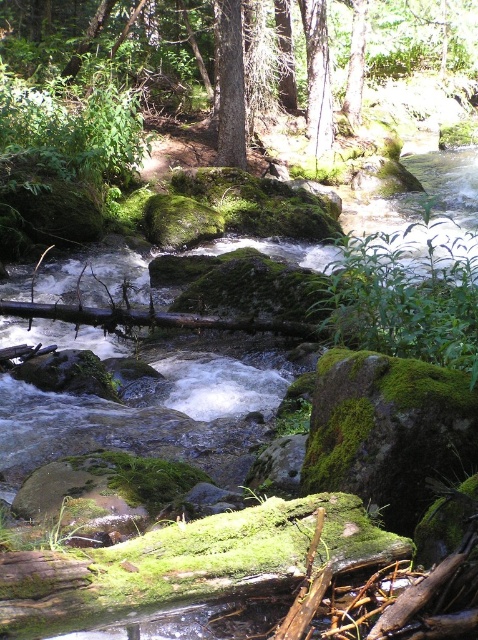
Question: Among these points, which one is nearest to the camera?

Choices:
 (A) (246, 152)
 (B) (358, 93)

Answer: (A)

Question: Can you confirm if green mossy rock at center is positioned to the left of green matte tree at center?

Choices:
 (A) no
 (B) yes

Answer: (A)

Question: Which point is farther from the camera taking this photo?

Choices:
 (A) (436, 51)
 (B) (237, 140)

Answer: (A)

Question: Which of the following is the farthest from the observer?

Choices:
 (A) (82, 42)
 (B) (224, 64)

Answer: (A)

Question: Observing the image, what is the correct spatial positioning of green mossy rock at center in reference to green matte tree at center?

Choices:
 (A) above
 (B) below

Answer: (A)

Question: Is green mossy rock at center behind green matte tree at center?

Choices:
 (A) yes
 (B) no

Answer: (A)